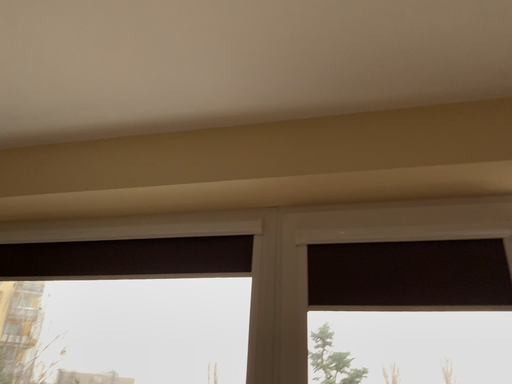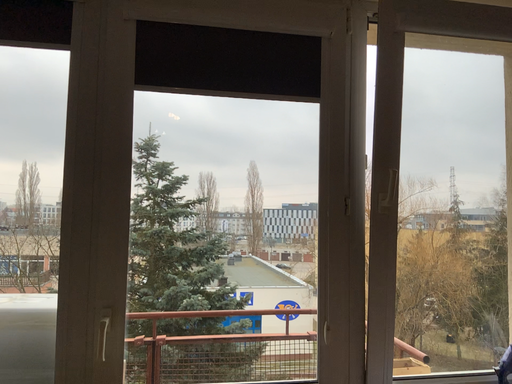
Question: How did the camera likely rotate when shooting the video?

Choices:
 (A) rotated left
 (B) rotated right

Answer: (B)